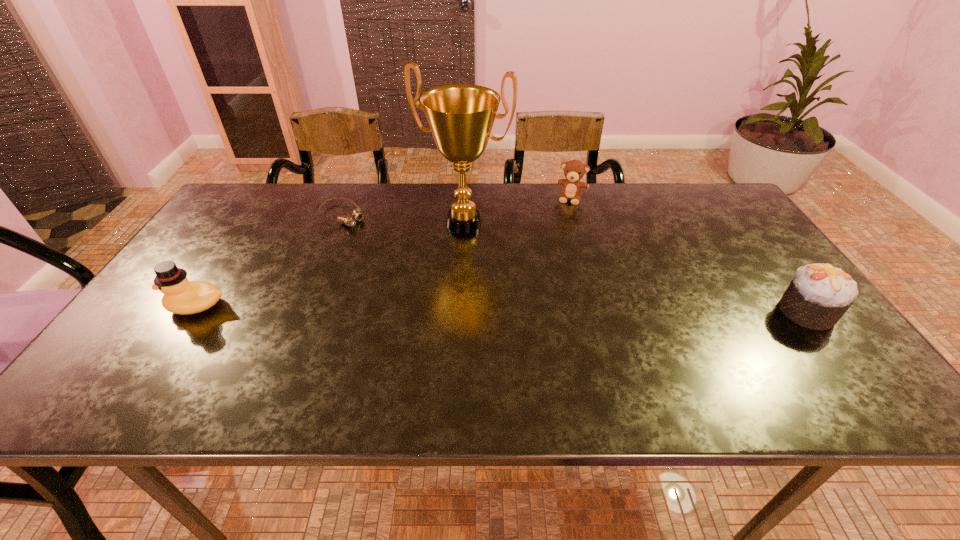
You are a GUI agent. You are given a task and a screenshot of the screen. Output one action in this format:
    pyautogui.click(x=<x>, y=<y>)
    Task: Click on the leftmost object
    This screenshot has width=960, height=540.
    Given the screenshot: What is the action you would take?
    pyautogui.click(x=181, y=296)

Locate an element on the screen. Image resolution: width=960 pixels, height=540 pixels. the rightmost object is located at coordinates (819, 295).

You are a GUI agent. You are given a task and a screenshot of the screen. Output one action in this format:
    pyautogui.click(x=<x>, y=<y>)
    Task: Click on the third object from left to right
    The height and width of the screenshot is (540, 960).
    Given the screenshot: What is the action you would take?
    pyautogui.click(x=460, y=116)

Image resolution: width=960 pixels, height=540 pixels. I want to click on the tallest object, so click(x=460, y=116).

The width and height of the screenshot is (960, 540). Find the location of `teddy bear`. teddy bear is located at coordinates (574, 170).

Locate an element on the screen. The image size is (960, 540). goggles is located at coordinates (347, 220).

The height and width of the screenshot is (540, 960). What are the coordinates of `the fourth object from right to left` in the screenshot? It's located at (347, 220).

Image resolution: width=960 pixels, height=540 pixels. I want to click on vacant area located on the left of the cupcake, so click(x=738, y=312).

Where is `vacant space located 0.340m on the front view with handles of the award`? The image size is (960, 540). vacant space located 0.340m on the front view with handles of the award is located at coordinates (400, 328).

The width and height of the screenshot is (960, 540). What are the coordinates of `vacant space situated on the front view with handles of the award` in the screenshot? It's located at (417, 299).